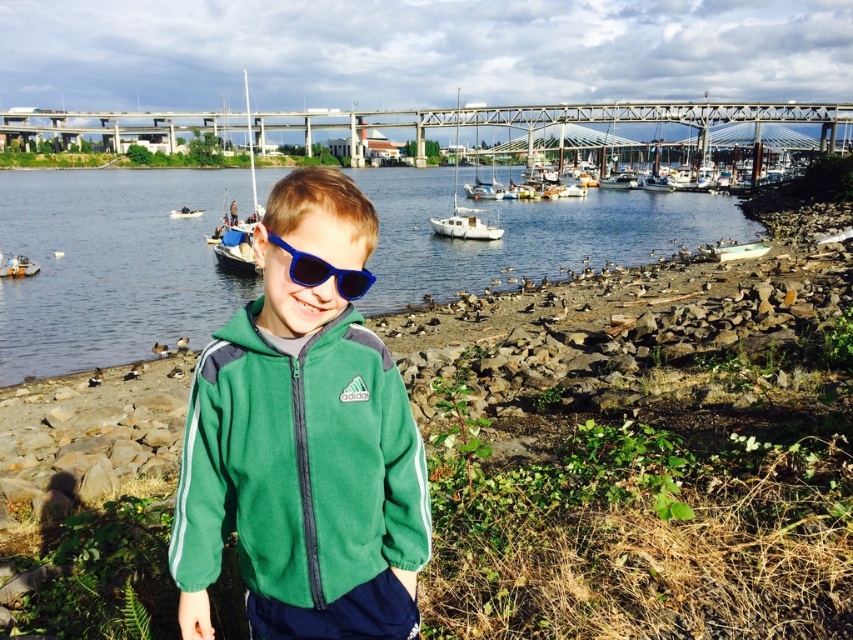
Does white matte sailboat at center have a greater height compared to white plastic boat at center?

Yes, white matte sailboat at center is taller than white plastic boat at center.

Where is `white matte sailboat at center`? The image size is (853, 640). white matte sailboat at center is located at coordinates (463, 211).

Where is `white matte sailboat at center`? The width and height of the screenshot is (853, 640). white matte sailboat at center is located at coordinates (463, 211).

Consider the image. Who is positioned more to the left, white matte sailboat at center or white plastic boat at left?

From the viewer's perspective, white plastic boat at left appears more on the left side.

Does white matte sailboat at center come behind white plastic boat at left?

Yes, white matte sailboat at center is further from the viewer.

What do you see at coordinates (463, 211) in the screenshot? I see `white matte sailboat at center` at bounding box center [463, 211].

The image size is (853, 640). I want to click on white matte sailboat at center, so click(463, 211).

Can you confirm if blue plastic sunglasses at center is positioned to the right of white plastic boat at left?

Indeed, blue plastic sunglasses at center is positioned on the right side of white plastic boat at left.

Who is more forward, (297, 264) or (16, 272)?

Point (297, 264)

Find the location of `blue plastic sunglasses at center`. blue plastic sunglasses at center is located at coordinates (323, 272).

Where is `blue plastic sunglasses at center`? The height and width of the screenshot is (640, 853). blue plastic sunglasses at center is located at coordinates (323, 272).